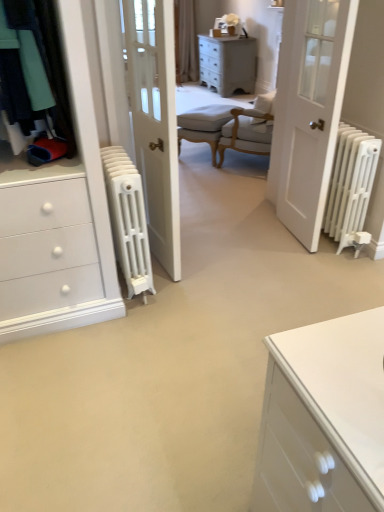
Identify the location of empty space that is in between white matte radiator at right and white matte radiator at left, which is counted as the 1th radiator, starting from the left. (230, 257).